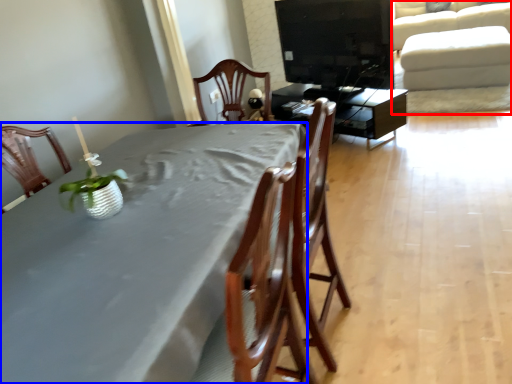
Question: Among these objects, which one is nearest to the camera, couch (highlighted by a red box) or table (highlighted by a blue box)?

Choices:
 (A) couch
 (B) table

Answer: (B)